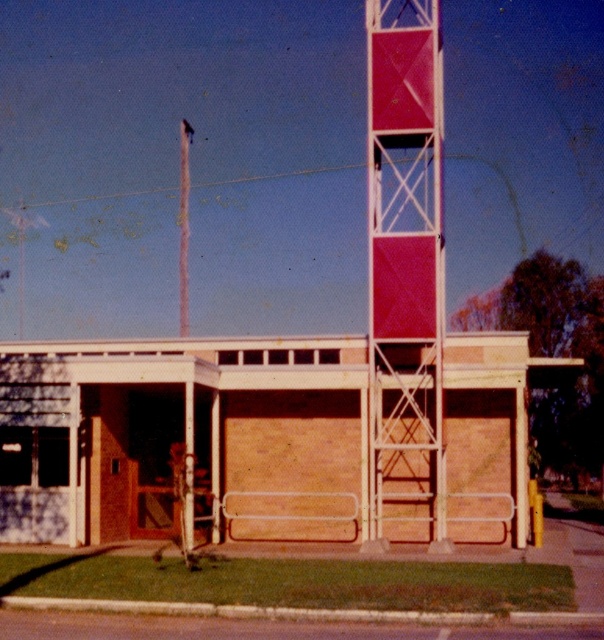
Question: Which point is closer to the camera taking this photo?

Choices:
 (A) (286, 356)
 (B) (400, 269)

Answer: (B)

Question: Which object appears farthest from the camera in this image?

Choices:
 (A) wooden boarded-up garage at center
 (B) metallic red bell tower at center

Answer: (B)

Question: Observing the image, what is the correct spatial positioning of wooden boarded-up garage at center in reference to metallic red bell tower at center?

Choices:
 (A) right
 (B) left

Answer: (B)

Question: In this image, where is wooden boarded-up garage at center located relative to metallic red bell tower at center?

Choices:
 (A) left
 (B) right

Answer: (A)

Question: Does wooden boarded-up garage at center lie behind metallic red bell tower at center?

Choices:
 (A) no
 (B) yes

Answer: (A)